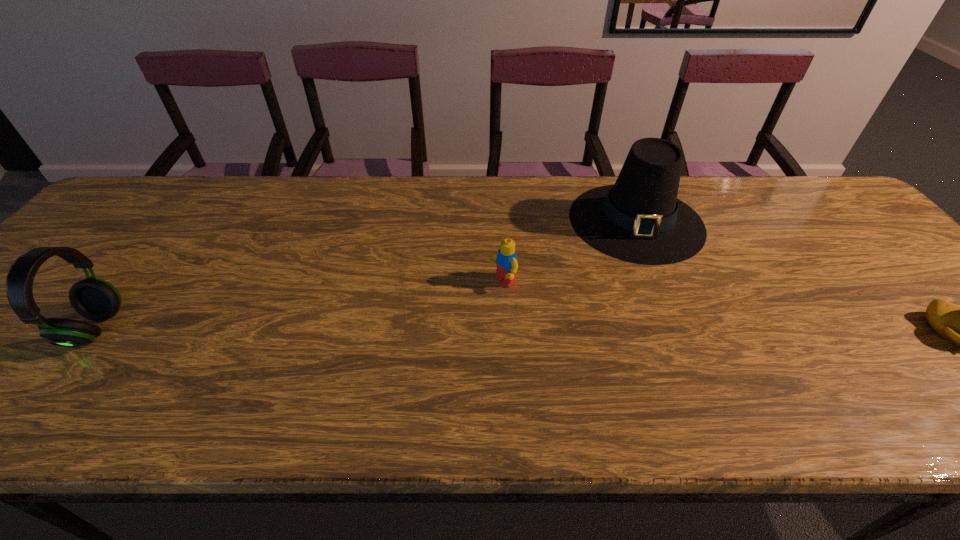
You are a GUI agent. You are given a task and a screenshot of the screen. Output one action in this format:
    pyautogui.click(x=<x>, y=<y>)
    Task: Click on the free space located on the front-facing side of the Lego
    This screenshot has height=540, width=960.
    Given the screenshot: What is the action you would take?
    pyautogui.click(x=390, y=350)

Locate an element on the screen. The image size is (960, 540). vacant space located on the front-facing side of the Lego is located at coordinates (381, 355).

The image size is (960, 540). I want to click on object that is at the far edge, so click(639, 219).

Identify the location of object that is at the near edge. 95,299.

Locate an element on the screen. free space at the far edge of the desktop is located at coordinates (478, 184).

This screenshot has width=960, height=540. I want to click on vacant region at the near edge, so click(x=829, y=352).

This screenshot has height=540, width=960. In the image, there is a desktop. In order to click on vacant space at the left edge in this screenshot , I will do `click(137, 228)`.

Where is `vacant space at the right edge of the desktop`? The image size is (960, 540). vacant space at the right edge of the desktop is located at coordinates (877, 310).

Where is `vacant area at the far left corner of the desktop`? Image resolution: width=960 pixels, height=540 pixels. vacant area at the far left corner of the desktop is located at coordinates (127, 219).

In the image, there is a desktop. At what (x,y) coordinates should I click in order to perform the action: click on vacant space at the far right corner. Please return your answer as a coordinate pair (x, y). The image size is (960, 540). Looking at the image, I should click on (x=833, y=201).